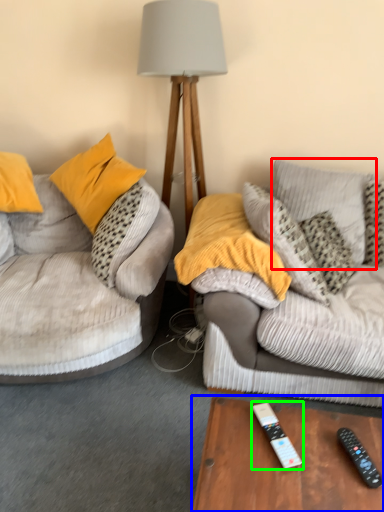
Question: Estimate the real-world distances between objects in this image. Which object is farther from pillow (highlighted by a red box), table (highlighted by a blue box) or remote control (highlighted by a green box)?

Choices:
 (A) table
 (B) remote control

Answer: (B)